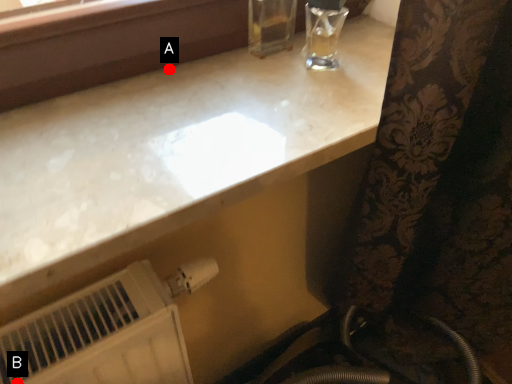
Question: Two points are circled on the image, labeled by A and B beside each circle. Which point is closer to the camera?

Choices:
 (A) A is closer
 (B) B is closer

Answer: (B)